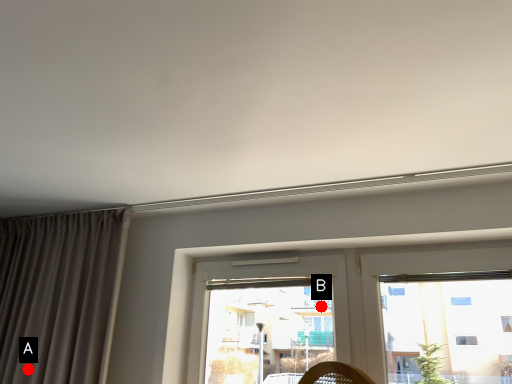
Question: Two points are circled on the image, labeled by A and B beside each circle. Which point is farther to the camera?

Choices:
 (A) A is further
 (B) B is further

Answer: (B)